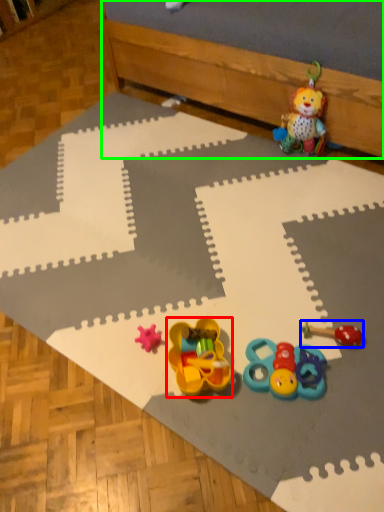
Question: Estimate the real-world distances between objects in this image. Which object is farther from toy (highlighted by a red box), toy (highlighted by a blue box) or bed frame (highlighted by a green box)?

Choices:
 (A) toy
 (B) bed frame

Answer: (B)